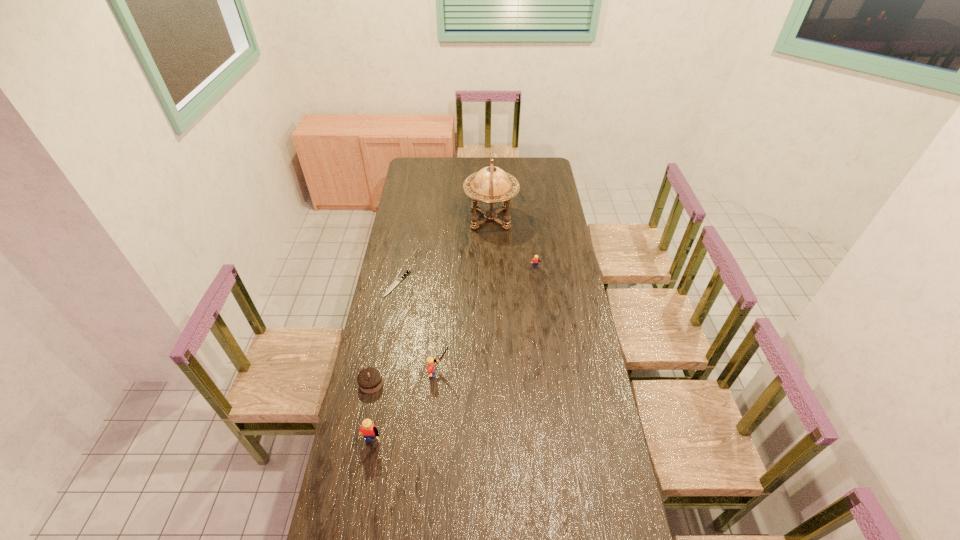
In order to click on steak knife that is at the left edge in this screenshot , I will do `click(398, 280)`.

Locate an element on the screen. free space at the far edge is located at coordinates (514, 171).

Find the location of `vacant space at the near edge`. vacant space at the near edge is located at coordinates coord(540,507).

Where is `free location at the left edge of the desktop`? The width and height of the screenshot is (960, 540). free location at the left edge of the desktop is located at coordinates (383, 293).

The width and height of the screenshot is (960, 540). Find the location of `free space at the right edge of the desktop`. free space at the right edge of the desktop is located at coordinates (580, 429).

Where is `vacant space at the far left corner`? The height and width of the screenshot is (540, 960). vacant space at the far left corner is located at coordinates (426, 178).

Identify the location of vacant space that's between the rightmost object and the nearest Lego. The image size is (960, 540). (453, 359).

At what (x,y) coordinates should I click in order to perform the action: click on vacant space in between the nearest Lego and the second object from right to left. Please return your answer as a coordinate pair (x, y). Image resolution: width=960 pixels, height=540 pixels. Looking at the image, I should click on tap(431, 334).

Where is `free area in between the shortest object and the shortest Lego`? The width and height of the screenshot is (960, 540). free area in between the shortest object and the shortest Lego is located at coordinates (467, 276).

Where is `free space between the shortest object and the rightmost Lego`? free space between the shortest object and the rightmost Lego is located at coordinates coord(467,276).